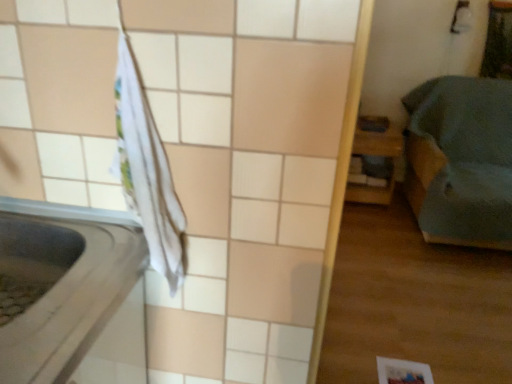
What do you see at coordinates (461, 160) in the screenshot?
I see `teal fabric bed at right, positioned as the second furniture in left-to-right order` at bounding box center [461, 160].

What are the coordinates of `white matte paper at lower right` in the screenshot? It's located at (402, 372).

Image resolution: width=512 pixels, height=384 pixels. Describe the element at coordinates (73, 294) in the screenshot. I see `white fabric at left` at that location.

In order to click on teal fabric bed at right, the 1th furniture positioned from the right in this screenshot , I will do `click(461, 160)`.

From the image's perspective, which furniture is the 2nd one above the white fabric at left? Please provide its 2D coordinates.

[(376, 155)]

Are white fabric at left and wooden shelf at right, the second furniture when ordered from right to left, located far from each other?

white fabric at left is positioned a significant distance from wooden shelf at right, the second furniture when ordered from right to left.

Which is behind, point (8, 247) or point (362, 147)?

The point (362, 147) is more distant.

Would you say white fabric at left is outside wooden shelf at right, the second furniture when ordered from right to left?

Indeed, white fabric at left is completely outside wooden shelf at right, the second furniture when ordered from right to left.

Locate an element on the screen. The height and width of the screenshot is (384, 512). appliance in front of the teal fabric bed at right, the 1th furniture positioned from the right is located at coordinates (73, 294).

Does point (407, 158) come behind point (140, 289)?

Yes, it is.

From a real-world perspective, is teal fabric bed at right, positioned as the second furniture in left-to-right order, physically above white fabric at left?

Actually, teal fabric bed at right, positioned as the second furniture in left-to-right order, is physically below white fabric at left in the real world.

Which of these two, teal fabric bed at right, positioned as the second furniture in left-to-right order, or white fabric at left, stands shorter?

With less height is white fabric at left.

From a real-world perspective, which object rests below the other?

In real-world perspective, teal fabric bed at right, the 1th furniture positioned from the right, is lower.

From the picture: Is white fabric at left oriented towards teal fabric bed at right, the 1th furniture positioned from the right?

No.

Between white fabric at left and teal fabric bed at right, the 1th furniture positioned from the right, which one has smaller size?

With smaller size is white fabric at left.

Is white matte paper at lower right positioned far away from white fabric at left?

That's right, there is a large distance between white matte paper at lower right and white fabric at left.

How different are the orientations of white matte paper at lower right and white fabric at left in degrees?

The facing directions of white matte paper at lower right and white fabric at left are 90 degrees apart.

Based on the photo, from a real-world perspective, does white matte paper at lower right stand above white fabric at left?

No, from a real-world perspective, white matte paper at lower right is not above white fabric at left.

Which is closer, (416, 367) or (55, 317)?

Positioned in front is point (55, 317).

From the picture: Which point is more distant from viewer, (71, 224) or (384, 379)?

Point (384, 379)

Can white matte paper at lower right be found inside white fabric at left?

No, white matte paper at lower right is not surrounded by white fabric at left.

Does white fabric at left have a greater height compared to white matte paper at lower right?

Indeed, white fabric at left has a greater height compared to white matte paper at lower right.

Is wooden shelf at right, which is counted as the first furniture, starting from the left, not inside white matte paper at lower right?

Indeed, wooden shelf at right, which is counted as the first furniture, starting from the left, is completely outside white matte paper at lower right.

Between wooden shelf at right, the second furniture when ordered from right to left, and white matte paper at lower right, which one has larger width?

Wider between the two is wooden shelf at right, the second furniture when ordered from right to left.

From the image's perspective, which object appears higher, wooden shelf at right, the second furniture when ordered from right to left, or white matte paper at lower right?

wooden shelf at right, the second furniture when ordered from right to left.

Does wooden shelf at right, which is counted as the first furniture, starting from the left, have a larger size compared to white matte paper at lower right?

Correct, wooden shelf at right, which is counted as the first furniture, starting from the left, is larger in size than white matte paper at lower right.

Does white matte paper at lower right turn towards teal fabric bed at right, the 1th furniture positioned from the right?

No, white matte paper at lower right is not aimed at teal fabric bed at right, the 1th furniture positioned from the right.

Based on their sizes in the image, would you say white matte paper at lower right is bigger or smaller than teal fabric bed at right, the 1th furniture positioned from the right?

In the image, white matte paper at lower right appears to be smaller than teal fabric bed at right, the 1th furniture positioned from the right.

Is the depth of white matte paper at lower right greater than that of teal fabric bed at right, positioned as the second furniture in left-to-right order?

No, it is in front of teal fabric bed at right, positioned as the second furniture in left-to-right order.

I want to click on the 2nd furniture located beneath the white fabric at left (from a real-world perspective), so click(x=376, y=155).

Where is `appliance below the teal fabric bed at right, positioned as the second furniture in left-to-right order (from the image's perspective)`? This screenshot has width=512, height=384. appliance below the teal fabric bed at right, positioned as the second furniture in left-to-right order (from the image's perspective) is located at coordinates (73, 294).

Based on their spatial positions, is white fabric at left or teal fabric bed at right, the 1th furniture positioned from the right, closer to white matte paper at lower right?

white fabric at left.

Estimate the real-world distances between objects in this image. Which object is closer to white fabric at left, teal fabric bed at right, positioned as the second furniture in left-to-right order, or wooden shelf at right, the second furniture when ordered from right to left?

teal fabric bed at right, positioned as the second furniture in left-to-right order, is closer to white fabric at left.

Considering their positions, is white matte paper at lower right positioned closer to teal fabric bed at right, the 1th furniture positioned from the right, than wooden shelf at right, which is counted as the first furniture, starting from the left?

Among the two, wooden shelf at right, which is counted as the first furniture, starting from the left, is located nearer to teal fabric bed at right, the 1th furniture positioned from the right.

In the scene shown: Based on their spatial positions, is white matte paper at lower right or wooden shelf at right, the second furniture when ordered from right to left, closer to white fabric at left?

The object closer to white fabric at left is white matte paper at lower right.

Which object lies nearer to the anchor point teal fabric bed at right, the 1th furniture positioned from the right, wooden shelf at right, which is counted as the first furniture, starting from the left, or white matte paper at lower right?

Based on the image, wooden shelf at right, which is counted as the first furniture, starting from the left, appears to be nearer to teal fabric bed at right, the 1th furniture positioned from the right.

Looking at the image, which one is located further to white fabric at left, wooden shelf at right, the second furniture when ordered from right to left, or teal fabric bed at right, the 1th furniture positioned from the right?

wooden shelf at right, the second furniture when ordered from right to left.

Looking at the image, which one is located closer to teal fabric bed at right, positioned as the second furniture in left-to-right order, white fabric at left or wooden shelf at right, which is counted as the first furniture, starting from the left?

Based on the image, wooden shelf at right, which is counted as the first furniture, starting from the left, appears to be nearer to teal fabric bed at right, positioned as the second furniture in left-to-right order.

Considering their positions, is wooden shelf at right, which is counted as the first furniture, starting from the left, positioned further to white matte paper at lower right than teal fabric bed at right, the 1th furniture positioned from the right?

→ wooden shelf at right, which is counted as the first furniture, starting from the left, lies further to white matte paper at lower right than the other object.

Locate an element on the screen. This screenshot has height=384, width=512. square located between white fabric at left and wooden shelf at right, which is counted as the first furniture, starting from the left, in the depth direction is located at coordinates (402, 372).

In order to click on square between white fabric at left and teal fabric bed at right, positioned as the second furniture in left-to-right order, from left to right in this screenshot , I will do `click(402, 372)`.

This screenshot has height=384, width=512. I want to click on furniture between white matte paper at lower right and wooden shelf at right, the second furniture when ordered from right to left, in the front-back direction, so click(x=461, y=160).

In order to click on furniture between white fabric at left and wooden shelf at right, the second furniture when ordered from right to left, along the z-axis in this screenshot , I will do `click(461, 160)`.